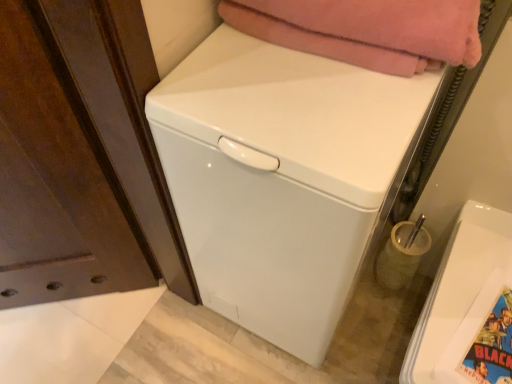
Find the location of a particular element. The height and width of the screenshot is (384, 512). blank space situated above white glossy washing machine at center, positioned as the 2th washing machine in right-to-left order (from a real-world perspective) is located at coordinates (301, 86).